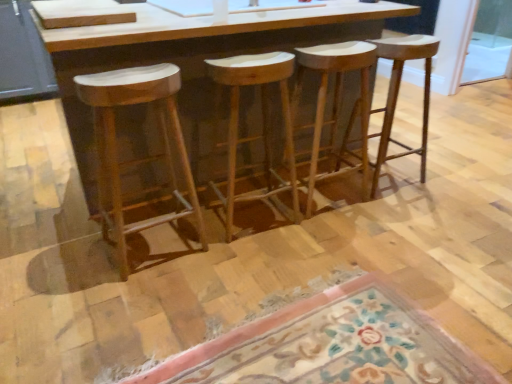
Find the location of a particular element. free spot below natural wood stool at center, the 2th stool in the right-to-left sequence (from a real-world perspective) is located at coordinates (329, 199).